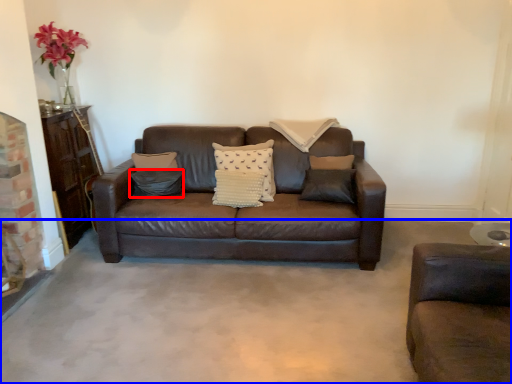
Question: Which object appears farthest to the camera in this image, pillow (highlighted by a red box) or concrete (highlighted by a blue box)?

Choices:
 (A) pillow
 (B) concrete

Answer: (A)